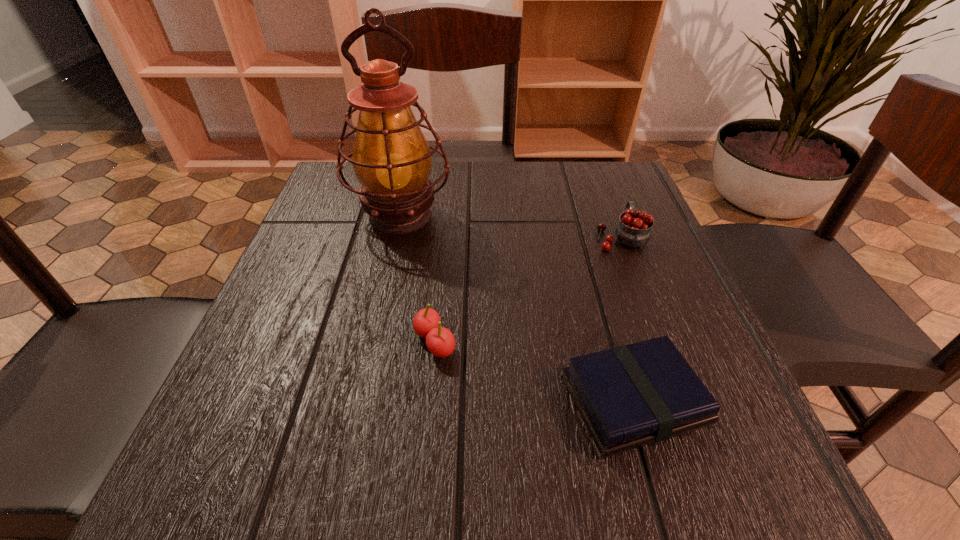
The width and height of the screenshot is (960, 540). Identify the location of free space between the tallest object and the third tallest object. [418, 279].

I want to click on empty location between the book and the left cherry, so click(x=535, y=371).

At what (x,y) coordinates should I click in order to perform the action: click on vacant area that lies between the shorter cherry and the third shortest object. Please return your answer as a coordinate pair (x, y). Image resolution: width=960 pixels, height=540 pixels. Looking at the image, I should click on (528, 289).

Find the location of a particular element. vacant area that lies between the third tallest object and the tallest object is located at coordinates (418, 279).

Where is `free space that is in between the nearer cherry and the right cherry`? free space that is in between the nearer cherry and the right cherry is located at coordinates (528, 289).

Locate an element on the screen. This screenshot has height=540, width=960. object that is the second nearest to the taller cherry is located at coordinates (391, 158).

Select which object is the second closest to the shortest object. Please provide its 2D coordinates. Your answer should be formatted as a tuple, i.e. [(x, y)], where the tuple contains the x and y coordinates of a point satisfying the conditions above.

[(634, 229)]